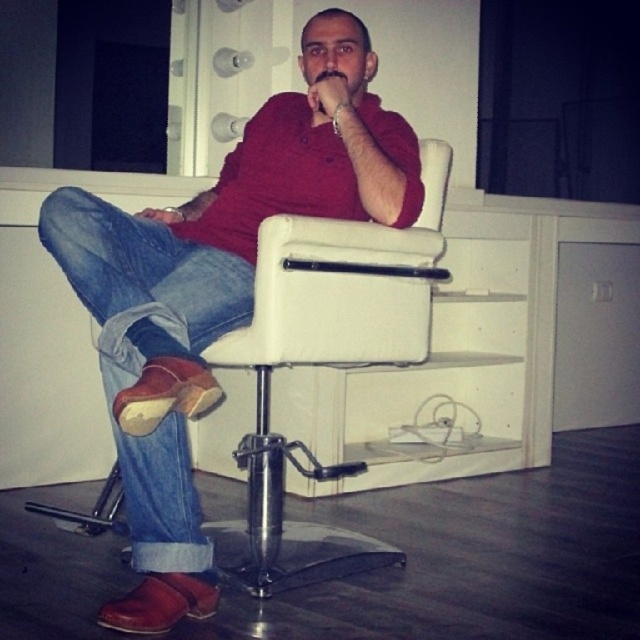
Question: Can you confirm if suede leather shoes at center is bigger than blue denim jeans at lower left?

Choices:
 (A) no
 (B) yes

Answer: (B)

Question: Among these objects, which one is nearest to the camera?

Choices:
 (A) blue denim jeans at lower left
 (B) suede leather shoes at center

Answer: (B)

Question: From the image, what is the correct spatial relationship of suede leather shoes at center in relation to blue denim jeans at lower left?

Choices:
 (A) right
 (B) left

Answer: (A)

Question: Which of the following is the farthest from the observer?

Choices:
 (A) suede leather shoes at center
 (B) blue denim jeans at lower left

Answer: (B)

Question: Can you confirm if suede leather shoes at center is thinner than blue denim jeans at lower left?

Choices:
 (A) yes
 (B) no

Answer: (B)